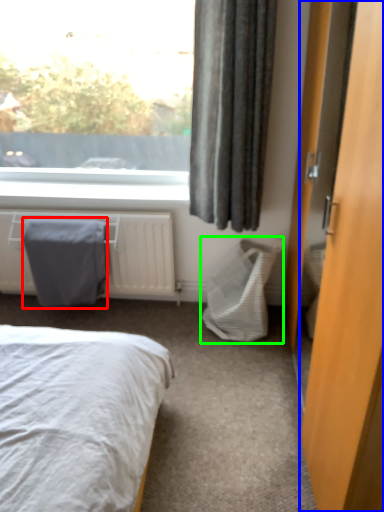
Question: Which object is the farthest from blanket (highlighted by a red box)? Choose among these: door (highlighted by a blue box) or laundry basket (highlighted by a green box).

Choices:
 (A) door
 (B) laundry basket

Answer: (A)